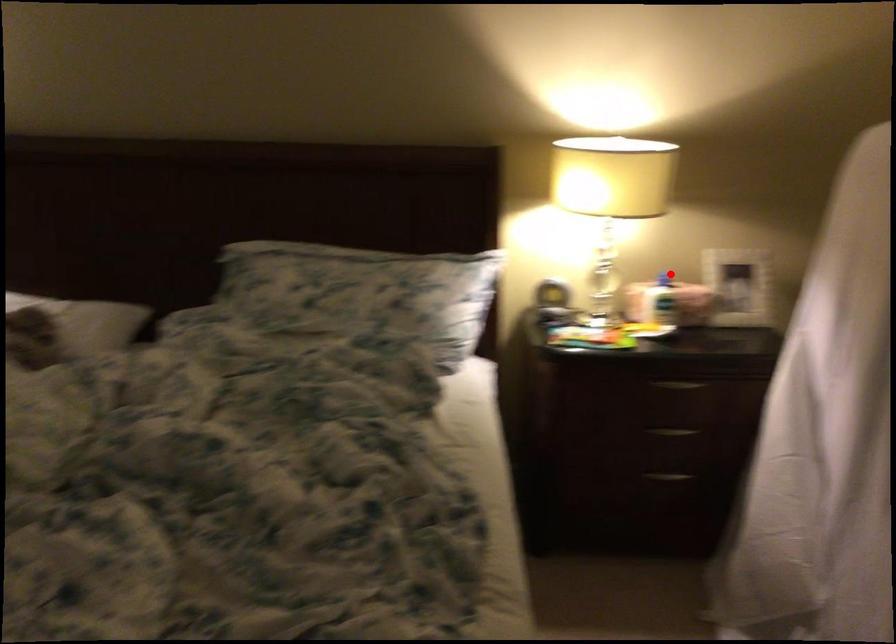
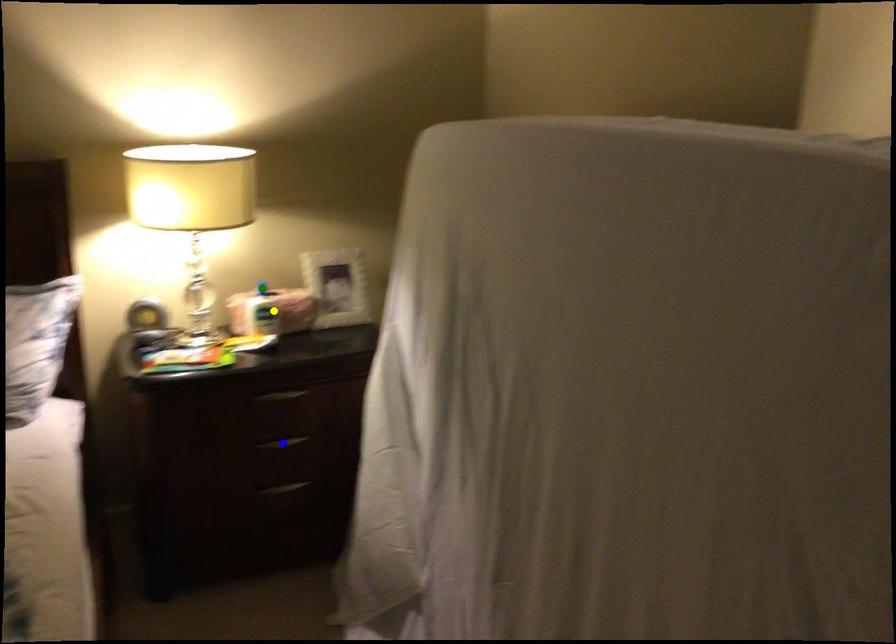
Question: I am providing you with two images of the same scene from different viewpoints. A red point is marked on the first image. You are given multiple points on the second image. Which mark in image 2 goes with the point in image 1?

Choices:
 (A) yellow point
 (B) green point
 (C) blue point

Answer: (B)